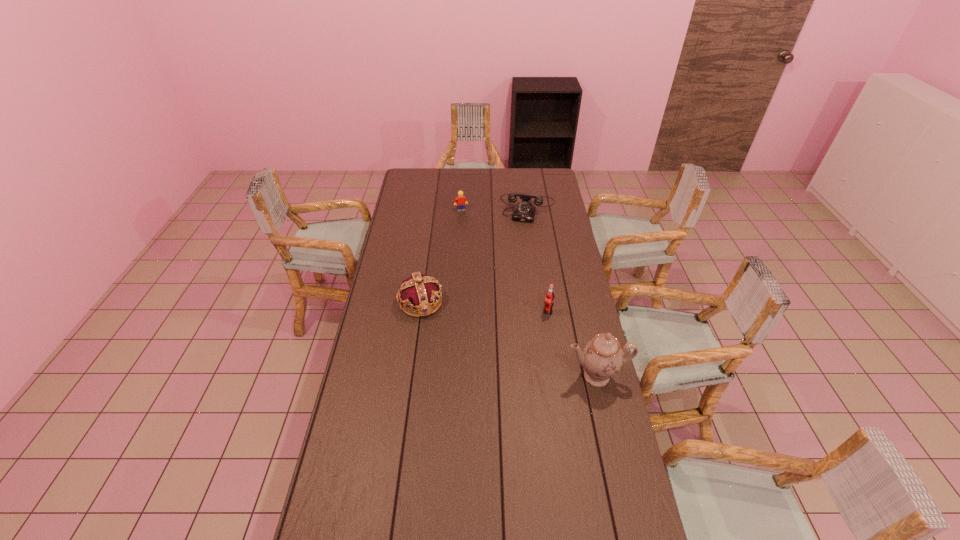
The width and height of the screenshot is (960, 540). I want to click on free space on the desktop that is between the leftmost object and the tallest object and is positioned on the front-facing side of the telephone, so click(503, 337).

Identify the location of vacant space on the desktop that is between the crown and the tallest object and is positioned on the label of the soda bottle. The image size is (960, 540). (516, 342).

At what (x,y) coordinates should I click in order to perform the action: click on vacant spot on the desktop that is between the crown and the nearest object and is positioned on the front-facing side of the second object from left to right. Please return your answer as a coordinate pair (x, y). The width and height of the screenshot is (960, 540). Looking at the image, I should click on (509, 339).